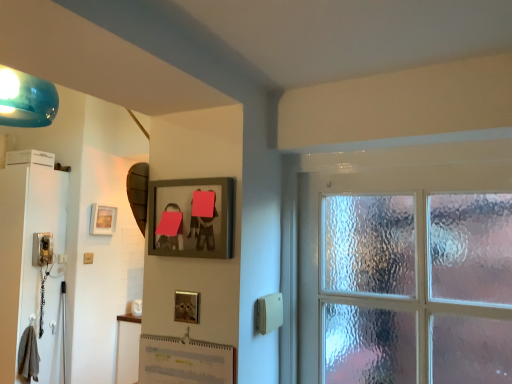
Locate an element on the screen. This screenshot has height=384, width=512. wooden picture frame at upper center, which ranks as the first picture frame in front-to-back order is located at coordinates (191, 217).

What do you see at coordinates (88, 258) in the screenshot?
I see `matte white light switch at lower left` at bounding box center [88, 258].

Where is `wooden picture frame at upper center, the second picture frame when ordered from back to front`? The height and width of the screenshot is (384, 512). wooden picture frame at upper center, the second picture frame when ordered from back to front is located at coordinates (191, 217).

From the image's perspective, does matte white light switch at lower left appear lower than matte black phone at left?

Correct, matte white light switch at lower left appears lower than matte black phone at left in the image.

Is matte white light switch at lower left taller or shorter than matte black phone at left?

In the image, matte white light switch at lower left appears to be shorter than matte black phone at left.

Can matte black phone at left be found inside matte white light switch at lower left?

Definitely not — matte black phone at left is not inside matte white light switch at lower left.

There is a matte white light switch at lower left. At what (x,y) coordinates should I click in order to perform the action: click on the 2nd picture frame above it (from a real-world perspective). Please return your answer as a coordinate pair (x, y). This screenshot has height=384, width=512. Looking at the image, I should click on (102, 220).

Between matte white light switch at lower left and matte gold picture frame at upper left, which ranks as the second picture frame in front-to-back order, which one has less height?

matte white light switch at lower left.

From the image's perspective, is matte white light switch at lower left below matte gold picture frame at upper left, which appears as the second picture frame when viewed from the right?

Yes, from the image's perspective, matte white light switch at lower left is below matte gold picture frame at upper left, which appears as the second picture frame when viewed from the right.

Looking at the image, does matte gold picture frame at upper left, arranged as the 1th picture frame when viewed from the back, seem bigger or smaller compared to matte white light switch at lower left?

Considering their sizes, matte gold picture frame at upper left, arranged as the 1th picture frame when viewed from the back, takes up more space than matte white light switch at lower left.

Is matte gold picture frame at upper left, arranged as the 1th picture frame when viewed from the back, taller than matte white light switch at lower left?

Yes.

Does matte gold picture frame at upper left, which appears as the second picture frame when viewed from the right, have a greater width compared to matte white light switch at lower left?

Yes.

Does white glossy screen door at left have a smaller size compared to wooden picture frame at upper center, positioned as the first picture frame in right-to-left order?

No, white glossy screen door at left is not smaller than wooden picture frame at upper center, positioned as the first picture frame in right-to-left order.

From the image's perspective, relative to wooden picture frame at upper center, which ranks as the first picture frame in front-to-back order, is white glossy screen door at left above or below?

Clearly, from the image's perspective, white glossy screen door at left is below wooden picture frame at upper center, which ranks as the first picture frame in front-to-back order.

Based on the photo, is white glossy screen door at left facing away from wooden picture frame at upper center, the second picture frame when ordered from back to front?

No.

Would you say white glossy screen door at left is inside or outside wooden picture frame at upper center, marked as the second picture frame in a left-to-right arrangement?

white glossy screen door at left lies outside wooden picture frame at upper center, marked as the second picture frame in a left-to-right arrangement.

Is matte black phone at left further to the viewer compared to white glossy screen door at left?

Yes.

From the image's perspective, which one is positioned lower, matte black phone at left or white glossy screen door at left?

From the image's view, white glossy screen door at left is below.

Considering the relative sizes of matte black phone at left and white glossy screen door at left in the image provided, is matte black phone at left smaller than white glossy screen door at left?

Correct, matte black phone at left occupies less space than white glossy screen door at left.

In the scene shown: Considering the relative sizes of matte black phone at left and white glossy screen door at left in the image provided, is matte black phone at left shorter than white glossy screen door at left?

Correct, matte black phone at left is not as tall as white glossy screen door at left.

Is matte gold picture frame at upper left, which ranks as the second picture frame in front-to-back order, situated inside matte black phone at left or outside?

matte gold picture frame at upper left, which ranks as the second picture frame in front-to-back order, is spatially situated outside matte black phone at left.

Considering the relative positions of matte gold picture frame at upper left, which ranks as the second picture frame in front-to-back order, and matte black phone at left in the image provided, is matte gold picture frame at upper left, which ranks as the second picture frame in front-to-back order, to the left of matte black phone at left from the viewer's perspective?

No, matte gold picture frame at upper left, which ranks as the second picture frame in front-to-back order, is not to the left of matte black phone at left.

From a real-world perspective, is matte gold picture frame at upper left, arranged as the 1th picture frame when viewed from the back, above or below matte black phone at left?

matte gold picture frame at upper left, arranged as the 1th picture frame when viewed from the back, is above matte black phone at left.

Who is shorter, white glossy screen door at left or matte gold picture frame at upper left, which ranks as the second picture frame in front-to-back order?

matte gold picture frame at upper left, which ranks as the second picture frame in front-to-back order.

From the image's perspective, is white glossy screen door at left above or below matte gold picture frame at upper left, positioned as the first picture frame in left-to-right order?

From the image's perspective, white glossy screen door at left appears below matte gold picture frame at upper left, positioned as the first picture frame in left-to-right order.

Is matte gold picture frame at upper left, arranged as the 1th picture frame when viewed from the back, a part of white glossy screen door at left?

Actually, matte gold picture frame at upper left, arranged as the 1th picture frame when viewed from the back, is outside white glossy screen door at left.

Based on the photo, would you say white glossy screen door at left is to the left or to the right of matte gold picture frame at upper left, arranged as the 1th picture frame when viewed from the back, in the picture?

In the image, white glossy screen door at left appears on the left side of matte gold picture frame at upper left, arranged as the 1th picture frame when viewed from the back.

In order to click on light switch below the matte black phone at left (from a real-world perspective) in this screenshot , I will do `click(88, 258)`.

This screenshot has width=512, height=384. Find the location of `light switch below the matte gold picture frame at upper left, which appears as the second picture frame when viewed from the right (from the image's perspective)`. light switch below the matte gold picture frame at upper left, which appears as the second picture frame when viewed from the right (from the image's perspective) is located at coordinates (88, 258).

Considering their positions, is white glossy screen door at left positioned closer to matte white light switch at lower left than matte gold picture frame at upper left, which appears as the second picture frame when viewed from the right?

Among the two, matte gold picture frame at upper left, which appears as the second picture frame when viewed from the right, is located nearer to matte white light switch at lower left.

Estimate the real-world distances between objects in this image. Which object is closer to matte gold picture frame at upper left, arranged as the 1th picture frame when viewed from the back, matte black phone at left or matte white light switch at lower left?

The object closer to matte gold picture frame at upper left, arranged as the 1th picture frame when viewed from the back, is matte white light switch at lower left.

When comparing their distances from matte black phone at left, does wooden picture frame at upper center, which ranks as the first picture frame in front-to-back order, or matte gold picture frame at upper left, which ranks as the second picture frame in front-to-back order, seem closer?

Among the two, matte gold picture frame at upper left, which ranks as the second picture frame in front-to-back order, is located nearer to matte black phone at left.

Which object lies further to the anchor point matte black phone at left, white glossy screen door at left or matte white light switch at lower left?

→ matte white light switch at lower left.

Based on their spatial positions, is wooden picture frame at upper center, which ranks as the first picture frame in front-to-back order, or matte white light switch at lower left closer to white glossy screen door at left?

matte white light switch at lower left is positioned closer to the anchor white glossy screen door at left.

Based on their spatial positions, is matte white light switch at lower left or wooden picture frame at upper center, marked as the second picture frame in a left-to-right arrangement, further from white glossy screen door at left?

Among the two, wooden picture frame at upper center, marked as the second picture frame in a left-to-right arrangement, is located further to white glossy screen door at left.

Which object lies further to the anchor point white glossy screen door at left, matte gold picture frame at upper left, arranged as the 1th picture frame when viewed from the back, or matte black phone at left?

matte gold picture frame at upper left, arranged as the 1th picture frame when viewed from the back, is further to white glossy screen door at left.

From the image, which object appears to be nearer to white glossy screen door at left, matte white light switch at lower left or matte gold picture frame at upper left, which appears as the second picture frame when viewed from the right?

matte gold picture frame at upper left, which appears as the second picture frame when viewed from the right.

You are a GUI agent. You are given a task and a screenshot of the screen. Output one action in this format:
    pyautogui.click(x=<x>, y=<y>)
    Task: Click on the screen door located between wooden picture frame at upper center, positioned as the first picture frame in right-to-left order, and matte white light switch at lower left in the depth direction
    This screenshot has width=512, height=384.
    Given the screenshot: What is the action you would take?
    pyautogui.click(x=31, y=259)

Where is `corded phone between wooden picture frame at upper center, marked as the second picture frame in a left-to-right arrangement, and matte gold picture frame at upper left, which ranks as the second picture frame in front-to-back order, from front to back`? This screenshot has width=512, height=384. corded phone between wooden picture frame at upper center, marked as the second picture frame in a left-to-right arrangement, and matte gold picture frame at upper left, which ranks as the second picture frame in front-to-back order, from front to back is located at coordinates (42, 249).

This screenshot has height=384, width=512. Find the location of `corded phone located between white glossy screen door at left and matte white light switch at lower left in the left-right direction`. corded phone located between white glossy screen door at left and matte white light switch at lower left in the left-right direction is located at coordinates (x=42, y=249).

Locate an element on the screen. The width and height of the screenshot is (512, 384). light switch between white glossy screen door at left and matte gold picture frame at upper left, positioned as the first picture frame in left-to-right order, from left to right is located at coordinates (88, 258).